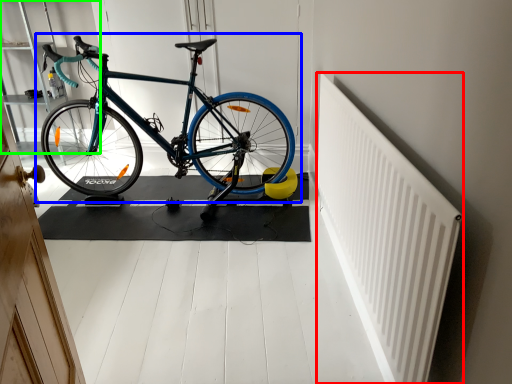
Question: Based on their relative distances, which object is nearer to radiator (highlighted by a red box)? Choose from bicycle (highlighted by a blue box) and shelf (highlighted by a green box).

Choices:
 (A) bicycle
 (B) shelf

Answer: (A)